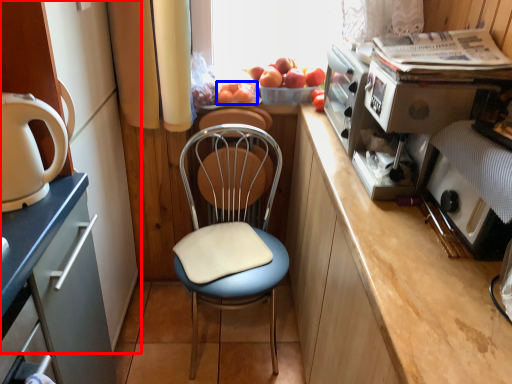
Question: Which object appears closest to the camera in this image, cabinetry (highlighted by a red box) or fruit (highlighted by a blue box)?

Choices:
 (A) cabinetry
 (B) fruit

Answer: (A)